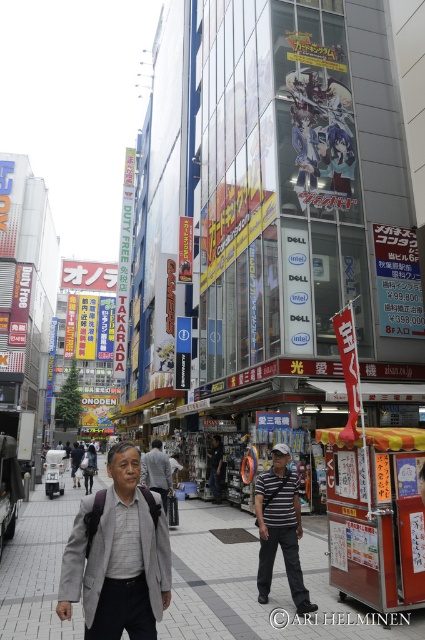
The height and width of the screenshot is (640, 425). What do you see at coordinates (280, 528) in the screenshot? I see `striped fabric shirt at center` at bounding box center [280, 528].

Between striped fabric shirt at center and dark gray shirt at center, which one is positioned higher?

Positioned higher is dark gray shirt at center.

What do you see at coordinates (280, 528) in the screenshot? The image size is (425, 640). I see `striped fabric shirt at center` at bounding box center [280, 528].

Find the location of a particular element. The width and height of the screenshot is (425, 640). striped fabric shirt at center is located at coordinates (280, 528).

Is point (232, 586) closer to viewer compared to point (260, 515)?

No, it is not.

Find the location of a particular element. This screenshot has height=640, width=425. gray concrete sidewalk at center is located at coordinates (252, 584).

This screenshot has height=640, width=425. Identify the location of dark gray shirt at center. (156, 472).

Is dark gray shirt at center below striped shirt at center?

No.

At what (x,y) coordinates should I click in order to perform the action: click on dark gray shirt at center. Please return your answer as a coordinate pair (x, y). The width and height of the screenshot is (425, 640). Looking at the image, I should click on (156, 472).

Locate an element on the screen. This screenshot has width=425, height=640. dark gray shirt at center is located at coordinates (156, 472).